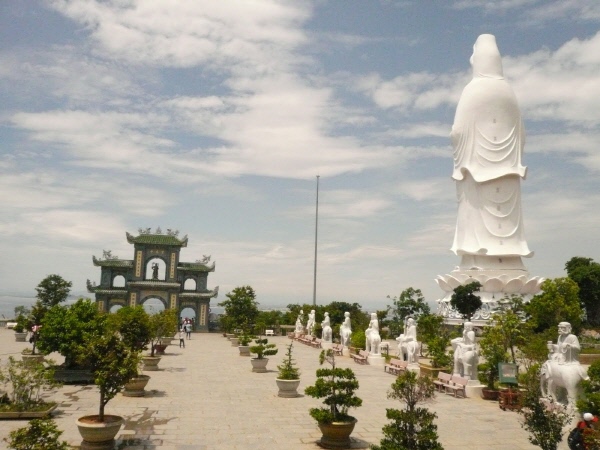
Image resolution: width=600 pixels, height=450 pixels. I want to click on statue, so click(x=480, y=173), click(x=570, y=362), click(x=464, y=355), click(x=410, y=341), click(x=373, y=331), click(x=346, y=323), click(x=328, y=323), click(x=312, y=316), click(x=297, y=319).